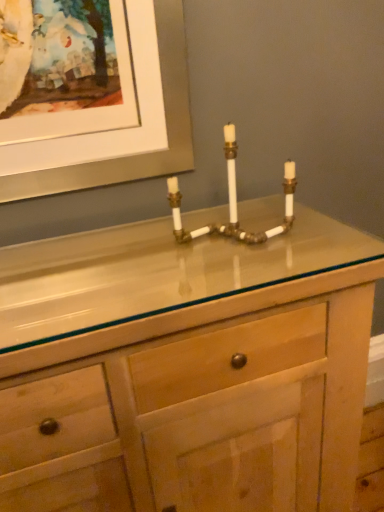
You are a GUI agent. You are given a task and a screenshot of the screen. Output one action in this format:
    pyautogui.click(x=<x>, y=<y>)
    Task: Click on the free space in front of brass/bronze pipe at center
    This screenshot has width=384, height=512.
    Given the screenshot: What is the action you would take?
    pyautogui.click(x=240, y=273)